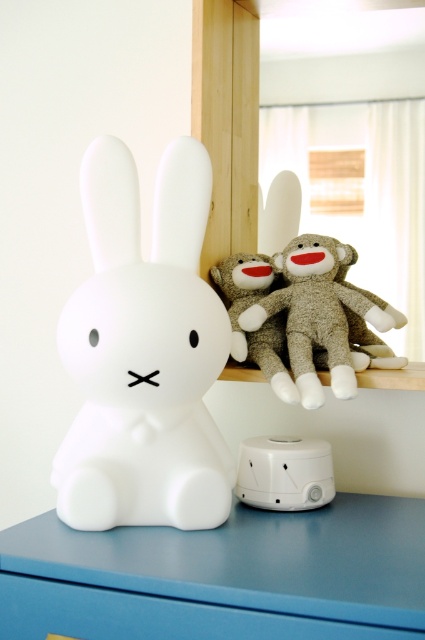
Measure the distance between white plush rabbit at upper center and camera.

A distance of 35.48 inches exists between white plush rabbit at upper center and camera.

The height and width of the screenshot is (640, 425). Identify the location of white plush rabbit at upper center. pos(319,314).

Is white matte rabbit at center shorter than white plush rabbit at upper center?

Incorrect, white matte rabbit at center's height does not fall short of white plush rabbit at upper center's.

The height and width of the screenshot is (640, 425). Identify the location of white matte rabbit at center. (144, 353).

Locate an element on the screen. matte white dresser at lower center is located at coordinates (223, 576).

Is point (323, 573) farther from camera compared to point (286, 276)?

No, it is not.

Where is `matte white dresser at lower center`? The width and height of the screenshot is (425, 640). matte white dresser at lower center is located at coordinates (223, 576).